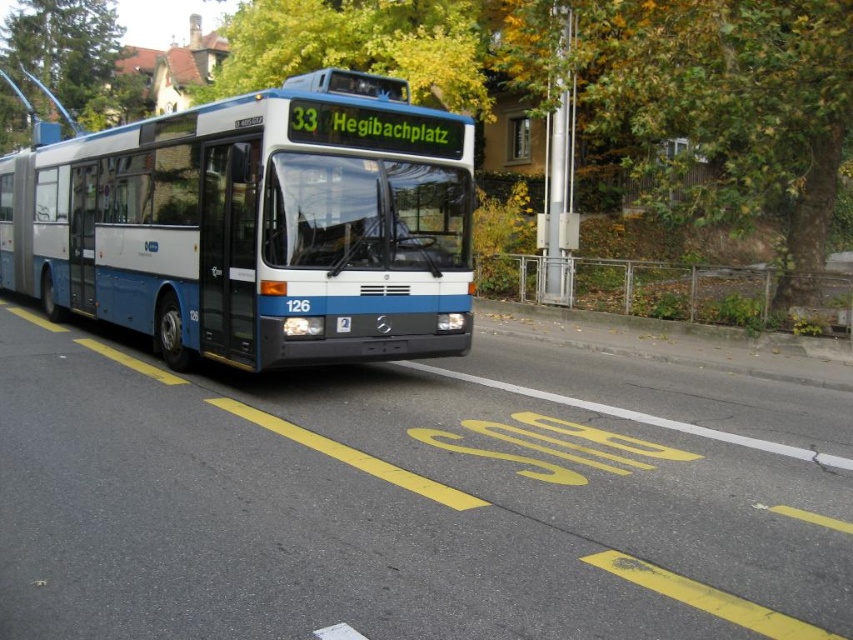
Can you confirm if green leafy tree at upper right is positioned below green leafy tree at upper center?

Yes, green leafy tree at upper right is below green leafy tree at upper center.

Is green leafy tree at upper right taller than green leafy tree at upper center?

No, green leafy tree at upper right is not taller than green leafy tree at upper center.

Does point (819, 212) lie behind point (50, 72)?

No, it is not.

Where is `green leafy tree at upper right`? green leafy tree at upper right is located at coordinates (704, 104).

Measure the distance from blue metallic bus at center to green leafy tree at upper right.

blue metallic bus at center is 23.73 feet away from green leafy tree at upper right.

Consider the image. Measure the distance between blue metallic bus at center and camera.

A distance of 7.40 meters exists between blue metallic bus at center and camera.

Where is `blue metallic bus at center`? The height and width of the screenshot is (640, 853). blue metallic bus at center is located at coordinates (256, 225).

Is blue metallic bus at center in front of blue metallic license plate at center?

Yes.

You are a GUI agent. You are given a task and a screenshot of the screen. Output one action in this format:
    pyautogui.click(x=<x>, y=<y>)
    Task: Click on the blue metallic bus at center
    Image resolution: width=853 pixels, height=640 pixels.
    Given the screenshot: What is the action you would take?
    pyautogui.click(x=256, y=225)